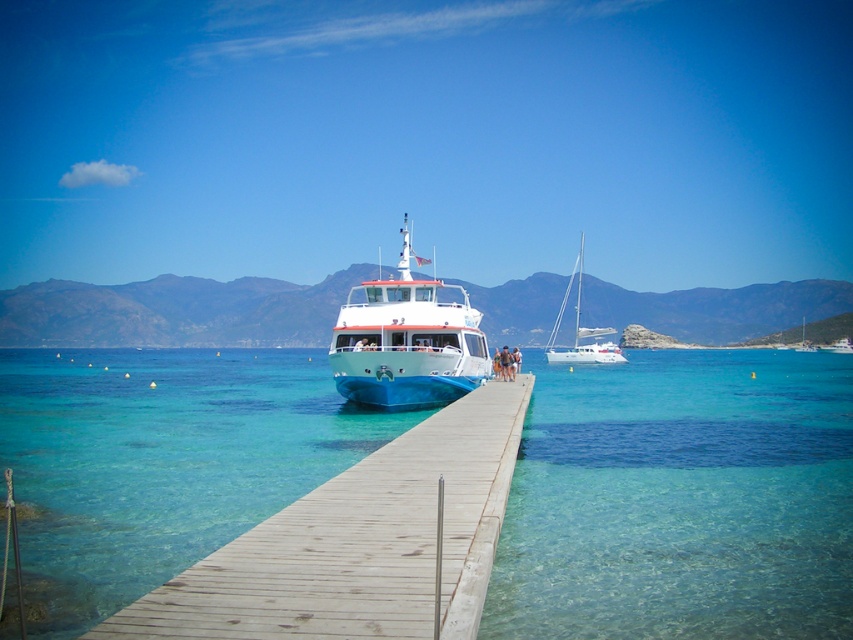
Question: Can you confirm if white glossy cruise ship at center is smaller than white glossy sailboat at right?

Choices:
 (A) no
 (B) yes

Answer: (B)

Question: Which of the following is the farthest from the observer?

Choices:
 (A) (596, 358)
 (B) (463, 300)
 (C) (473, 499)

Answer: (A)

Question: Where is wooden at center located in relation to white glossy cruise ship at center in the image?

Choices:
 (A) below
 (B) above

Answer: (A)

Question: Is wooden at center to the left of white glossy sailboat at right from the viewer's perspective?

Choices:
 (A) no
 (B) yes

Answer: (B)

Question: Estimate the real-world distances between objects in this image. Which object is closer to the white glossy cruise ship at center?

Choices:
 (A) white glossy sailboat at right
 (B) wooden at center

Answer: (B)

Question: Which of the following is the closest to the observer?

Choices:
 (A) (399, 518)
 (B) (415, 336)

Answer: (A)